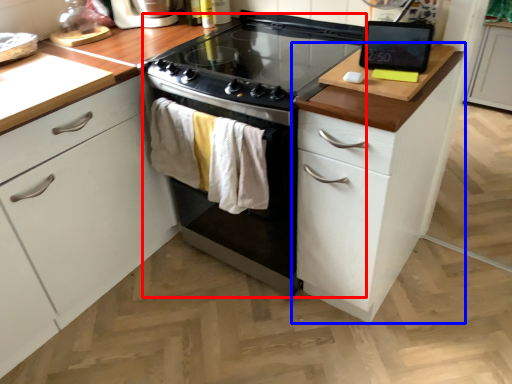
Question: Which of the following is the farthest to the observer, oven (highlighted by a red box) or cabinetry (highlighted by a blue box)?

Choices:
 (A) oven
 (B) cabinetry

Answer: (A)